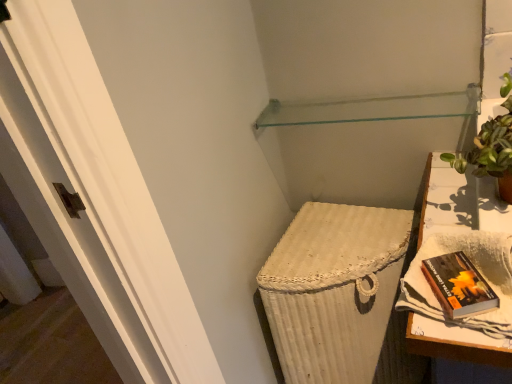
Question: Should I look upward or downward to see white woven table at right?

Choices:
 (A) down
 (B) up

Answer: (A)

Question: Is white woven table at right next to transparent glass shelf at upper center and touching it?

Choices:
 (A) no
 (B) yes

Answer: (A)

Question: Can you confirm if white woven table at right is positioned to the right of transparent glass shelf at upper center?

Choices:
 (A) yes
 (B) no

Answer: (A)

Question: Is white woven table at right wider than transparent glass shelf at upper center?

Choices:
 (A) yes
 (B) no

Answer: (A)

Question: Can you confirm if white woven table at right is positioned to the left of transparent glass shelf at upper center?

Choices:
 (A) yes
 (B) no

Answer: (B)

Question: Is white woven table at right surrounding transparent glass shelf at upper center?

Choices:
 (A) yes
 (B) no

Answer: (B)

Question: Considering the relative sizes of white woven table at right and transparent glass shelf at upper center in the image provided, is white woven table at right bigger than transparent glass shelf at upper center?

Choices:
 (A) no
 (B) yes

Answer: (B)

Question: From the image's perspective, is transparent glass shelf at upper center above hardcover book at right?

Choices:
 (A) yes
 (B) no

Answer: (A)

Question: Is transparent glass shelf at upper center further to camera compared to hardcover book at right?

Choices:
 (A) no
 (B) yes

Answer: (B)

Question: Is transparent glass shelf at upper center oriented towards hardcover book at right?

Choices:
 (A) yes
 (B) no

Answer: (B)

Question: From the image's perspective, is transparent glass shelf at upper center below hardcover book at right?

Choices:
 (A) yes
 (B) no

Answer: (B)

Question: Is transparent glass shelf at upper center shorter than hardcover book at right?

Choices:
 (A) no
 (B) yes

Answer: (B)

Question: Is hardcover book at right at the back of transparent glass shelf at upper center?

Choices:
 (A) no
 (B) yes

Answer: (A)

Question: Is hardcover book at right closer to camera compared to green leafy plant in terracotta pot at upper right?

Choices:
 (A) yes
 (B) no

Answer: (A)